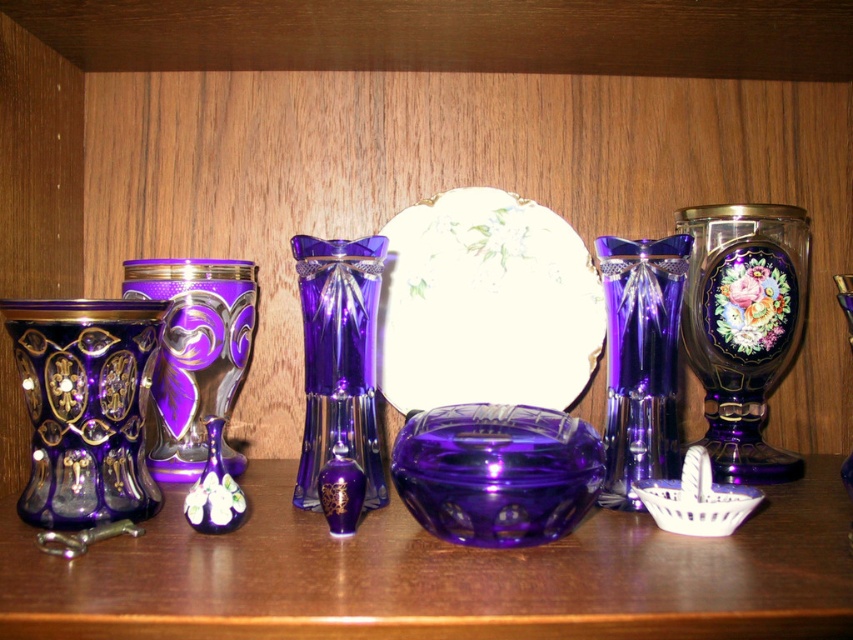
Who is taller, matte purple vase at right or matte purple glass vase at center-left?

matte purple vase at right

Is matte purple vase at right above matte purple glass vase at center-left?

Yes, matte purple vase at right is above matte purple glass vase at center-left.

Locate an element on the screen. matte purple vase at right is located at coordinates (743, 324).

Does matte purple vase at right have a smaller size compared to transparent purple vase at center?

Actually, matte purple vase at right might be larger than transparent purple vase at center.

Is matte purple vase at right positioned before transparent purple vase at center?

No, it is behind transparent purple vase at center.

Between point (785, 278) and point (849, 545), which one is positioned in front?

Point (849, 545) is more forward.

This screenshot has height=640, width=853. In order to click on matte purple vase at right in this screenshot , I will do `click(743, 324)`.

Does matte purple vase at center appear on the right side of transparent purple vase at center?

No, matte purple vase at center is not to the right of transparent purple vase at center.

Who is more distant from viewer, (201, 508) or (851, 540)?

The point (201, 508) is behind.

The image size is (853, 640). Identify the location of matte purple vase at center. (213, 490).